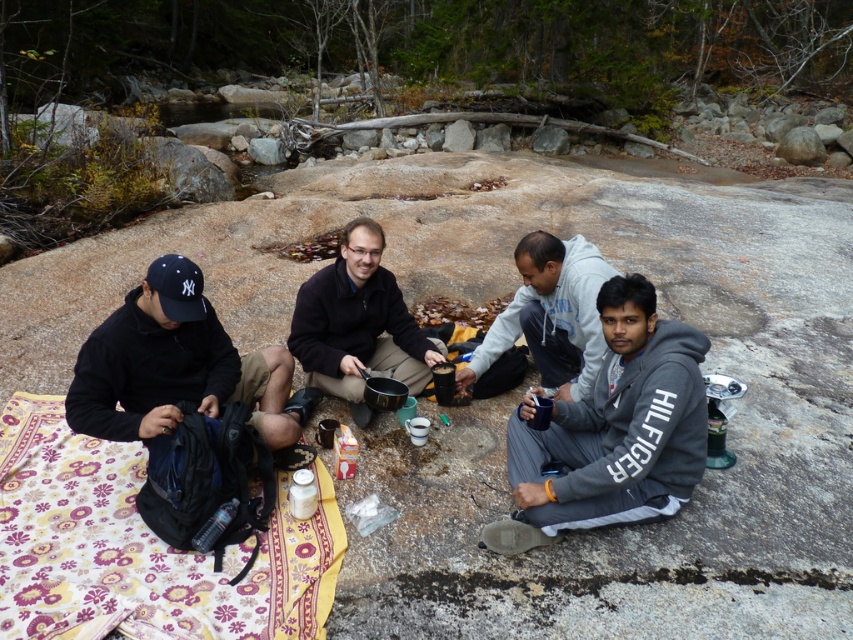
Who is more distant from viewer, (189, 365) or (543, 292)?

The point (543, 292) is behind.

Does black matte jacket at lower left have a greater width compared to gray fleece jacket at center?

Indeed, black matte jacket at lower left has a greater width compared to gray fleece jacket at center.

Between point (120, 356) and point (561, 330), which one is positioned in front?

Positioned in front is point (120, 356).

Where is `black matte jacket at lower left`? black matte jacket at lower left is located at coordinates (175, 365).

Is patterned fabric blanket at lower left further to camera compared to black matte jacket at lower left?

That is False.

Can you confirm if patterned fabric blanket at lower left is thinner than black matte jacket at lower left?

In fact, patterned fabric blanket at lower left might be wider than black matte jacket at lower left.

Which is behind, point (3, 557) or point (183, 314)?

Point (183, 314)

Find the location of a particular element. patterned fabric blanket at lower left is located at coordinates (141, 545).

Between gray fleece jacket at lower right and matte black jacket at center, which one appears on the left side from the viewer's perspective?

From the viewer's perspective, matte black jacket at center appears more on the left side.

Is point (683, 410) in front of point (364, 243)?

Yes, point (683, 410) is closer to viewer.

Find the location of a particular element. Image resolution: width=853 pixels, height=640 pixels. gray fleece jacket at lower right is located at coordinates (610, 429).